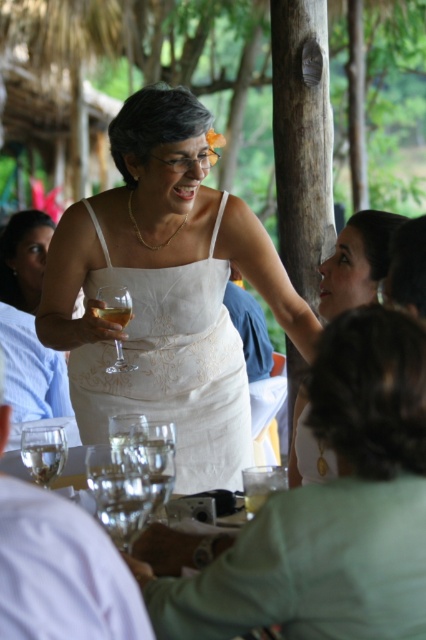
Can you confirm if matte white dress at center is positioned above clear glass wine at center?

Actually, matte white dress at center is below clear glass wine at center.

Which is above, matte white dress at center or clear glass wine at center?

clear glass wine at center is higher up.

Image resolution: width=426 pixels, height=640 pixels. What do you see at coordinates (356, 260) in the screenshot?
I see `matte white dress at center` at bounding box center [356, 260].

Where is `matte white dress at center`? matte white dress at center is located at coordinates (356, 260).

Does clear glass at lower left have a lesser width compared to clear glass wine glass at center?

No, clear glass at lower left is not thinner than clear glass wine glass at center.

Looking at this image, does clear glass at lower left appear under clear glass wine glass at center?

Yes, clear glass at lower left is below clear glass wine glass at center.

At what (x,y) coordinates should I click in order to perform the action: click on clear glass at lower left. Please return your answer as a coordinate pair (x, y). The image size is (426, 640). Looking at the image, I should click on (62, 572).

Where is `clear glass at lower left`? The height and width of the screenshot is (640, 426). clear glass at lower left is located at coordinates (62, 572).

Does white embroidered dress at center have a greater width compared to clear glass wine glass at center?

Yes.

Can you confirm if white embroidered dress at center is taller than clear glass wine glass at center?

Yes.

The height and width of the screenshot is (640, 426). I want to click on white embroidered dress at center, so click(172, 365).